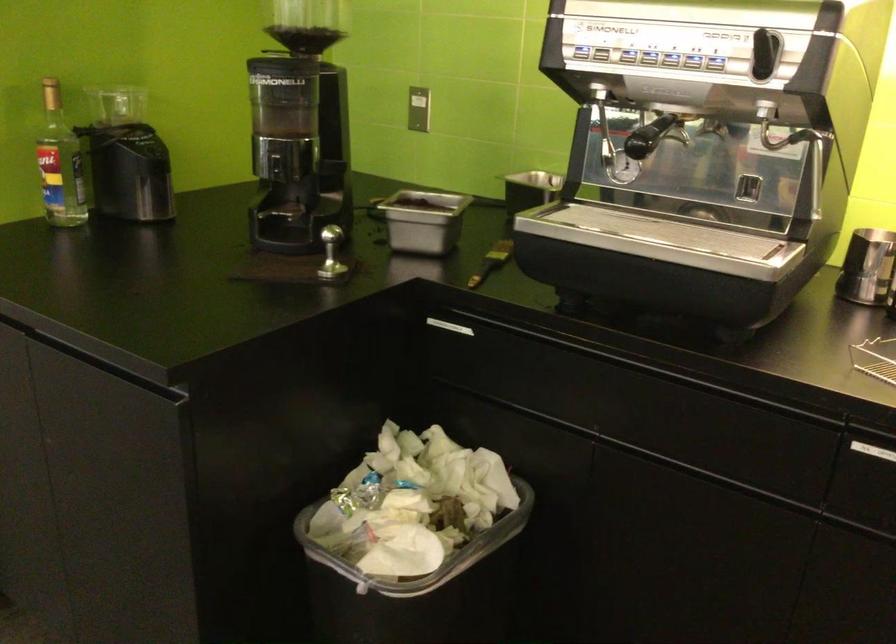
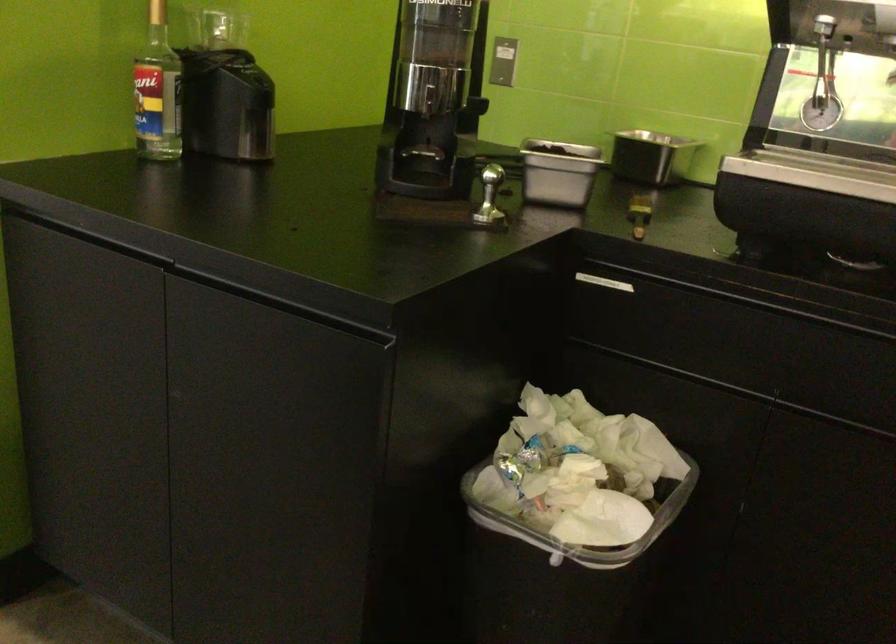
The point at (283, 167) is marked in the first image. Where is the corresponding point in the second image?

(433, 100)